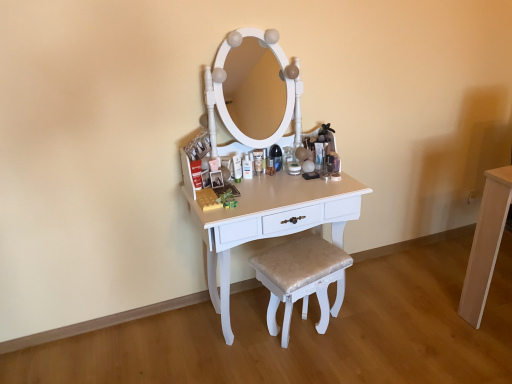
Where is `free area in between white glossy table at center, which appears as the 1th table when viewed from the left, and light wood cabinet at right, the 1th table when ordered from right to left`? The height and width of the screenshot is (384, 512). free area in between white glossy table at center, which appears as the 1th table when viewed from the left, and light wood cabinet at right, the 1th table when ordered from right to left is located at coordinates (409, 302).